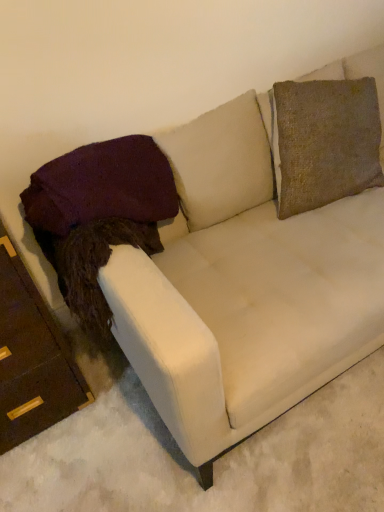
Image resolution: width=384 pixels, height=512 pixels. In order to click on free space on the front side of dark wood dresser at lower left in this screenshot , I will do pyautogui.click(x=64, y=469).